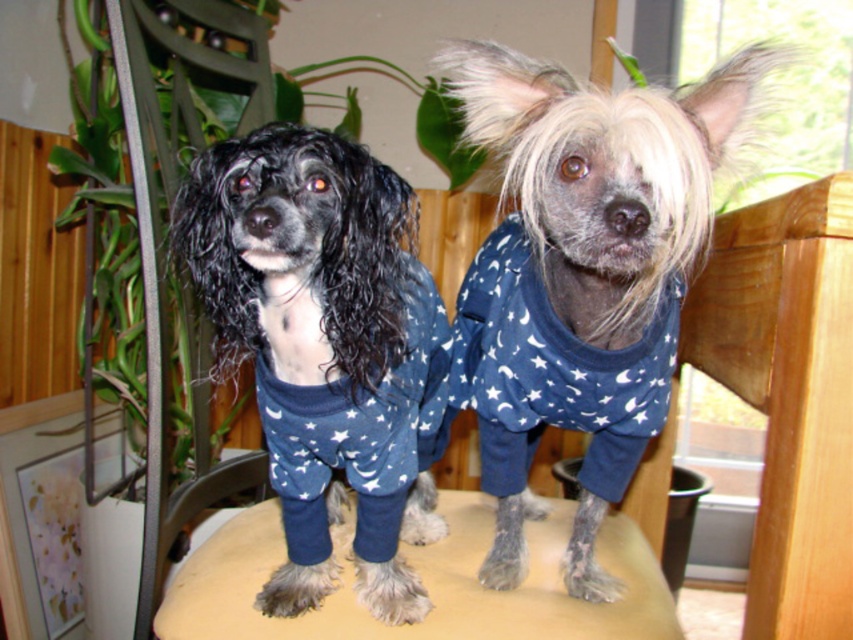
Question: Can you confirm if shiny black fur at center is positioned above beige fabric stool at center?

Choices:
 (A) no
 (B) yes

Answer: (B)

Question: Is beige fabric stool at center to the left of wooden chair at center from the viewer's perspective?

Choices:
 (A) no
 (B) yes

Answer: (A)

Question: Can you confirm if blue star-patterned sweater at center is bigger than beige fabric stool at center?

Choices:
 (A) no
 (B) yes

Answer: (B)

Question: Which point is closer to the camera?

Choices:
 (A) (460, 618)
 (B) (560, 212)
 (C) (206, 352)

Answer: (B)

Question: Which of the following is the farthest from the observer?

Choices:
 (A) (213, 248)
 (B) (450, 280)
 (C) (582, 109)

Answer: (B)

Question: Among these points, which one is nearest to the camera?

Choices:
 (A) (219, 192)
 (B) (566, 612)
 (C) (605, 531)

Answer: (A)